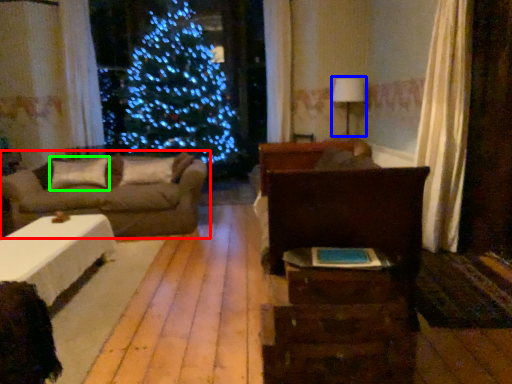
Question: Which object is positioned farthest from studio couch (highlighted by a red box)? Select from lamp (highlighted by a blue box) and pillow (highlighted by a green box).

Choices:
 (A) lamp
 (B) pillow

Answer: (A)